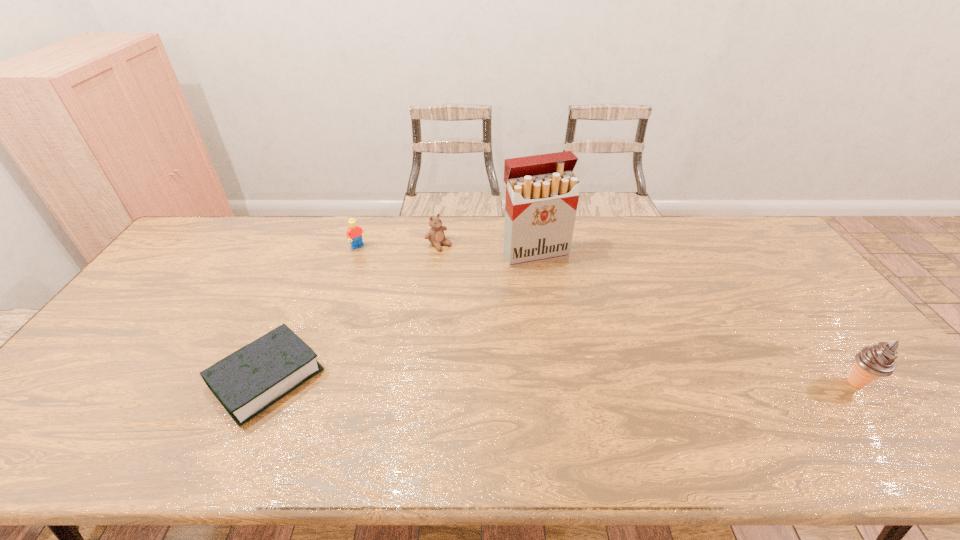
This screenshot has width=960, height=540. Find the location of `Lego that is at the far edge`. Lego that is at the far edge is located at coordinates (354, 233).

Where is `Bible at the near edge`? The width and height of the screenshot is (960, 540). Bible at the near edge is located at coordinates (248, 381).

You are a GUI agent. You are given a task and a screenshot of the screen. Output one action in this format:
    pyautogui.click(x=<x>, y=<y>)
    Task: Click on the icecream positioned at the near edge
    The image size is (960, 540).
    Given the screenshot: What is the action you would take?
    pyautogui.click(x=875, y=361)

Identify the location of object present at the right edge. This screenshot has height=540, width=960. (875, 361).

Identify the location of object at the near right corner. (875, 361).

At what (x,y) coordinates should I click in order to perform the action: click on free space at the far edge. Please return your answer as a coordinate pair (x, y). Looking at the image, I should click on (227, 249).

Locate an element on the screen. The width and height of the screenshot is (960, 540). free spot at the near edge of the desktop is located at coordinates (777, 402).

This screenshot has height=540, width=960. In order to click on vacant space at the left edge of the desktop in this screenshot , I will do `click(167, 318)`.

You are a GUI agent. You are given a task and a screenshot of the screen. Output one action in this format:
    pyautogui.click(x=<x>, y=<y>)
    Task: Click on the vacant space at the right edge of the desktop
    
    Given the screenshot: What is the action you would take?
    pyautogui.click(x=823, y=343)

You are a GUI agent. You are given a task and a screenshot of the screen. Output one action in this format:
    pyautogui.click(x=<x>, y=<y>)
    Task: Click on the blank space at the near left corner of the desktop
    
    Given the screenshot: What is the action you would take?
    pyautogui.click(x=72, y=396)